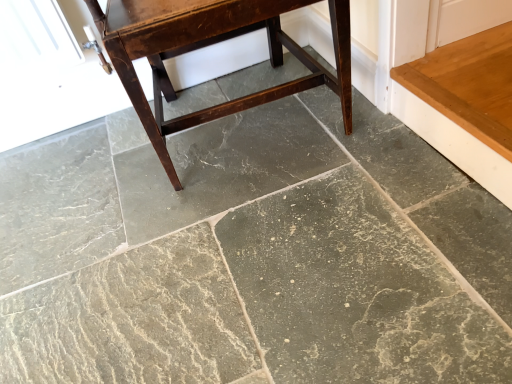
The image size is (512, 384). I want to click on vacant region in front of dark brown wood table at center, so click(x=275, y=236).